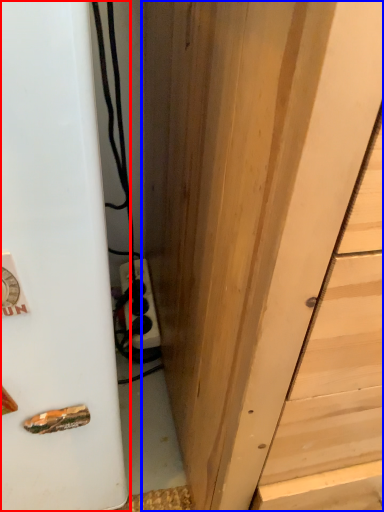
Question: Among these objects, which one is nearest to the camera, appliance (highlighted by a red box) or door (highlighted by a blue box)?

Choices:
 (A) appliance
 (B) door

Answer: (B)